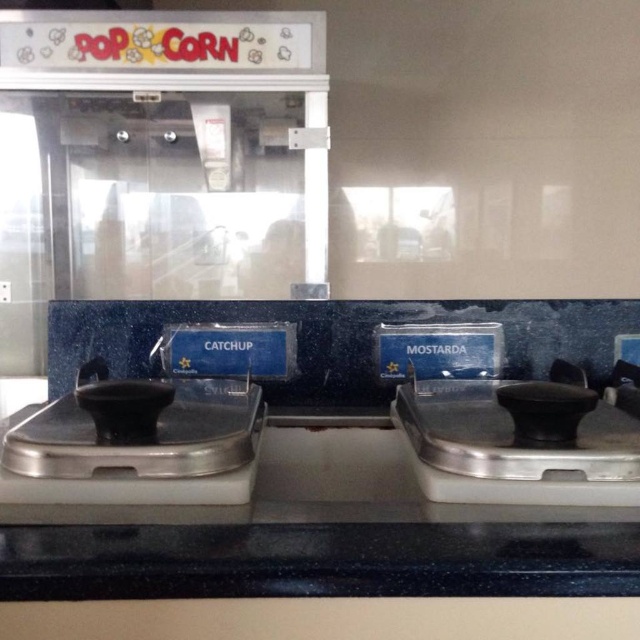
You are a customer holding a 12 inch long movie ticket stub. You want to place it between the satin silver dispenser at left and the black rubber condiment dispenser at right. Will the ticket stub fit horizontally between them?

The distance between the satin silver dispenser at left and the black rubber condiment dispenser at right is 10.96 inches. Since the ticket stub is 12 inches long, it will not fit horizontally between them as the space is narrower than the stub.

You are standing in front of the popcorn machine and condiment station. There is a point labeled as point (317, 560). Can you tell me what object is located at that point?

The point (317, 560) corresponds to the black plastic tray at center.

Based on the photo, you are at a cinema concession stand and need to grab a taller dispenser to fill your cup. Which dispenser should you choose between the satin silver dispenser at left and the black rubber condiment dispenser at right?

The satin silver dispenser at left is much taller than the black rubber condiment dispenser at right, so you should choose the satin silver dispenser at left.